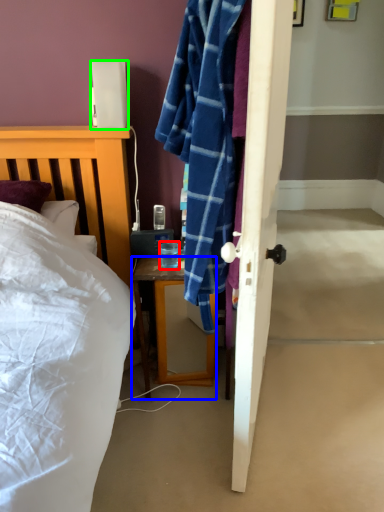
Question: Which is nearer to the coffee cup (highlighted by a red box)? desk (highlighted by a blue box) or lamp (highlighted by a green box).

Choices:
 (A) desk
 (B) lamp

Answer: (A)